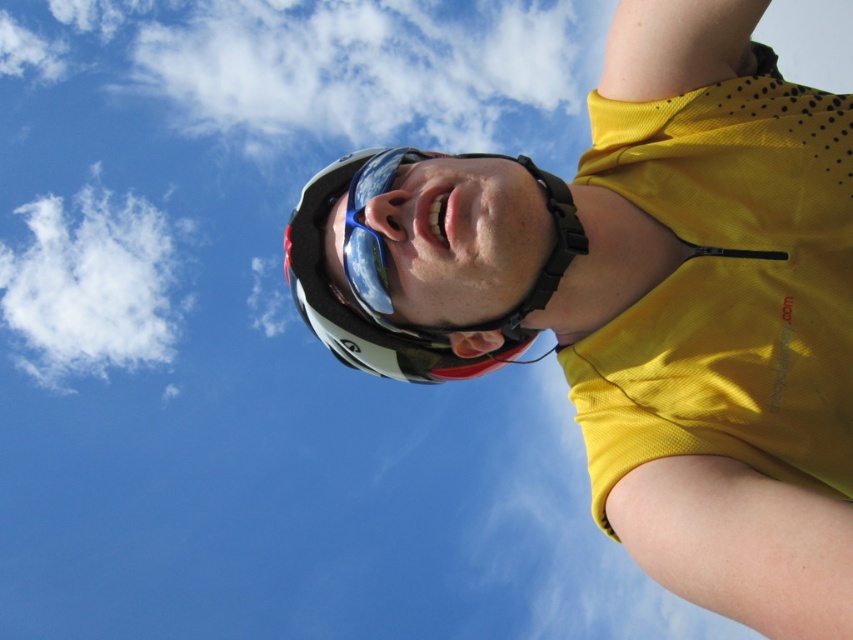
Is white matte bicycle helmet at center below blue reflective goggles at center?

Yes, white matte bicycle helmet at center is below blue reflective goggles at center.

Between point (404, 339) and point (347, 260), which one is positioned behind?

The point (404, 339) is behind.

Is point (291, 252) in front of point (381, 307)?

No.

Locate an element on the screen. white matte bicycle helmet at center is located at coordinates (355, 308).

Does white fluffy cloud at upper left appear over blue reflective goggles at center?

Yes, white fluffy cloud at upper left is above blue reflective goggles at center.

Can you confirm if white fluffy cloud at upper left is thinner than blue reflective goggles at center?

Incorrect, white fluffy cloud at upper left's width is not less than blue reflective goggles at center's.

I want to click on white fluffy cloud at upper left, so click(90, 284).

Is point (73, 355) behind point (415, 368)?

Yes.

Which is above, white fluffy cloud at upper left or white matte bicycle helmet at center?

white fluffy cloud at upper left is higher up.

Identify the location of white fluffy cloud at upper left. Image resolution: width=853 pixels, height=640 pixels. (90, 284).

The image size is (853, 640). I want to click on white fluffy cloud at upper left, so click(x=90, y=284).